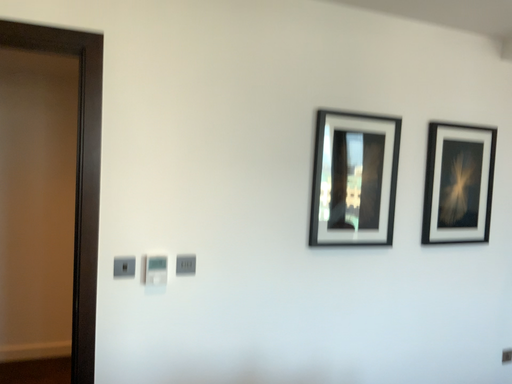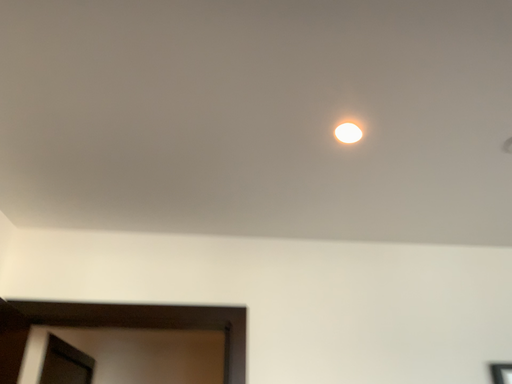
Question: How did the camera likely rotate when shooting the video?

Choices:
 (A) rotated right
 (B) rotated left

Answer: (B)